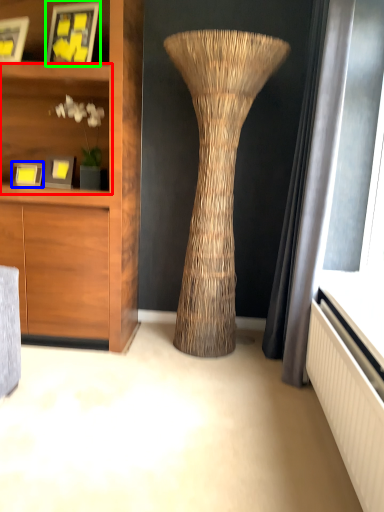
Question: Which object is positioned closest to shelf (highlighted by a red box)? Select from picture frame (highlighted by a blue box) and picture frame (highlighted by a green box).

Choices:
 (A) picture frame
 (B) picture frame

Answer: (B)